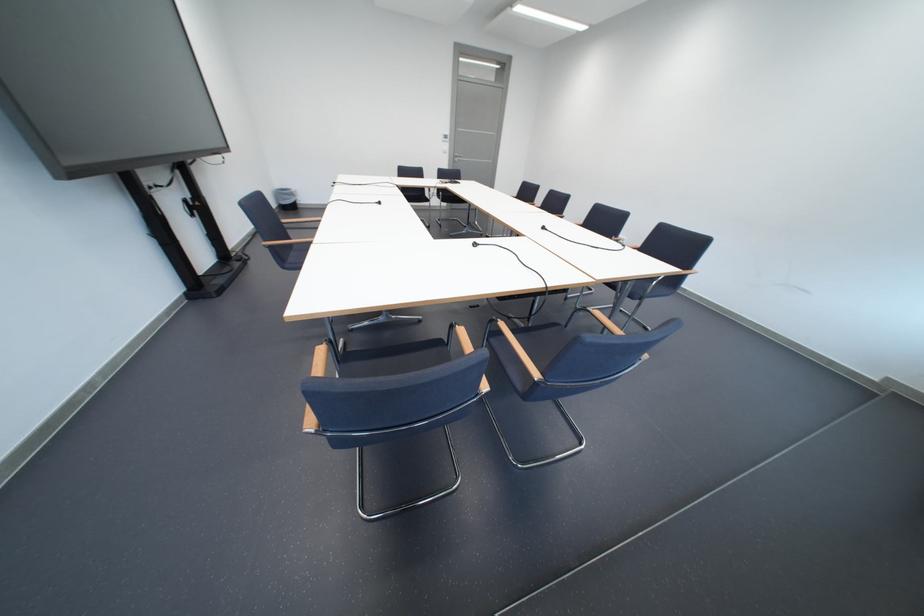
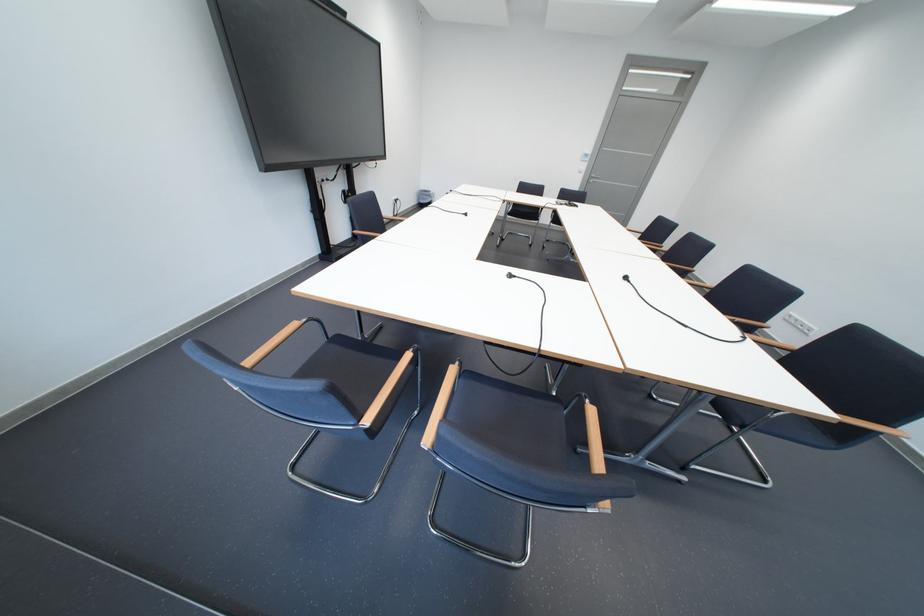
Locate, in the second image, the point that corresponds to (458,148) in the first image.

(596, 168)